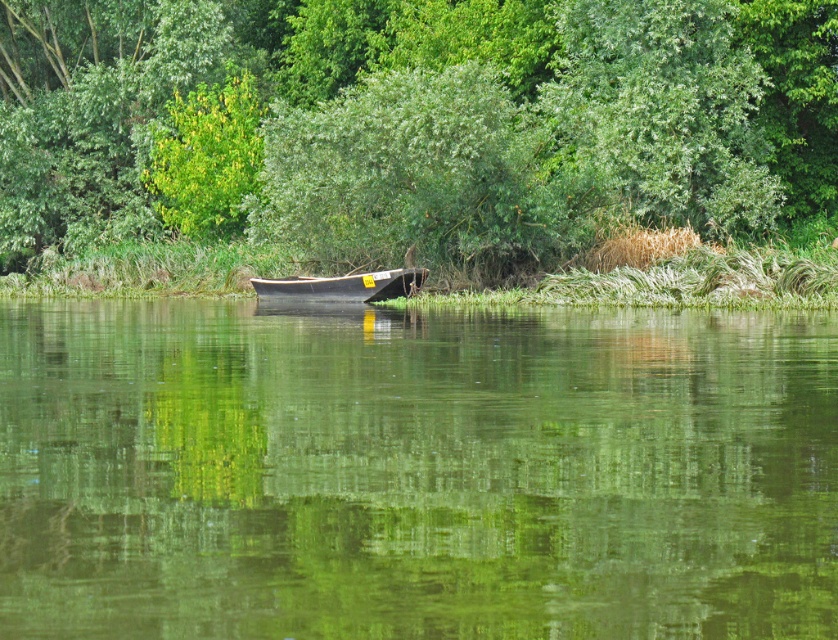
Between green smooth water at center and green leafy tree at center, which one has less height?

green smooth water at center is shorter.

Is point (35, 387) positioned before point (396, 168)?

Yes, it is in front of point (396, 168).

The width and height of the screenshot is (838, 640). What are the coordinates of `green smooth water at center` in the screenshot? It's located at (414, 472).

Can you confirm if green leafy tree at center is smaller than wooden boat at center?

No, green leafy tree at center is not smaller than wooden boat at center.

Is green leafy tree at center to the right of wooden boat at center from the viewer's perspective?

No, green leafy tree at center is not to the right of wooden boat at center.

Find the location of a particular element. This screenshot has width=838, height=640. green leafy tree at center is located at coordinates (412, 124).

The image size is (838, 640). Describe the element at coordinates (414, 472) in the screenshot. I see `green smooth water at center` at that location.

Who is taller, green smooth water at center or wooden boat at center?

With more height is green smooth water at center.

Is point (48, 552) behind point (329, 285)?

No, (48, 552) is in front of (329, 285).

You are a GUI agent. You are given a task and a screenshot of the screen. Output one action in this format:
    pyautogui.click(x=<x>, y=<y>)
    Task: Click on the green smooth water at center
    
    Given the screenshot: What is the action you would take?
    pyautogui.click(x=414, y=472)